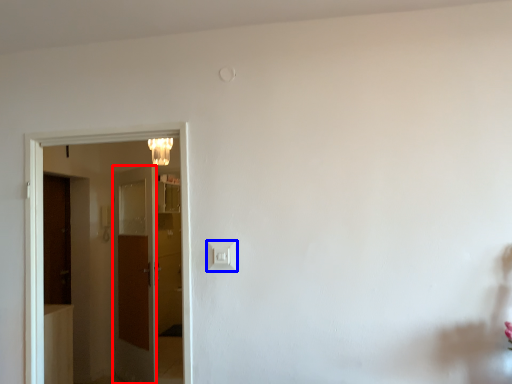
Question: Which object appears farthest to the camera in this image, door (highlighted by a red box) or light switch (highlighted by a blue box)?

Choices:
 (A) door
 (B) light switch

Answer: (A)